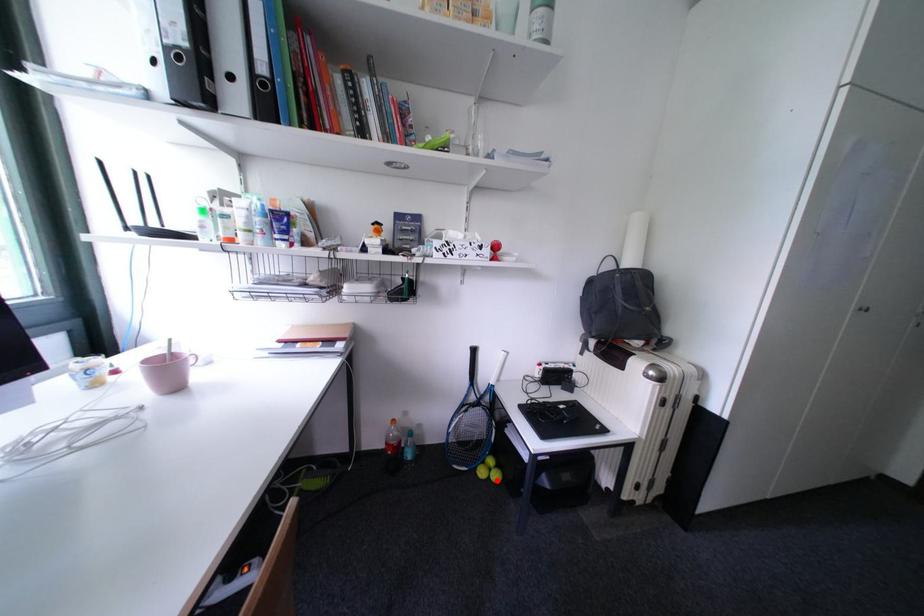
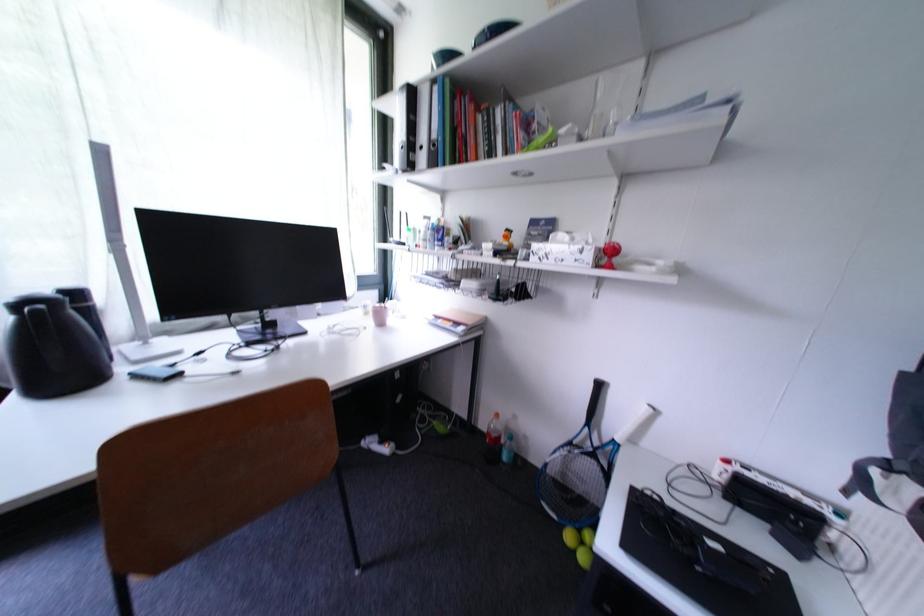
Question: A red point is marked in image1. In image2, is the corresponding 3D point closer to the camera or farther? Reply with the corresponding letter.

Choices:
 (A) The corresponding 3D point is closer.
 (B) The corresponding 3D point is farther.

Answer: (A)